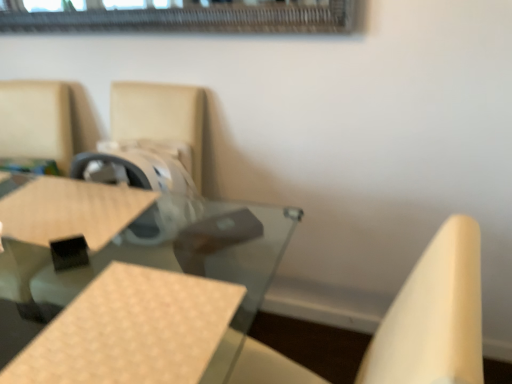
Locate an element on the screen. The width and height of the screenshot is (512, 384). beige woven plywood at center is located at coordinates (131, 330).

Image resolution: width=512 pixels, height=384 pixels. What do you see at coordinates (131, 288) in the screenshot? I see `clear glass table at center` at bounding box center [131, 288].

You are a GUI agent. You are given a task and a screenshot of the screen. Output one action in this format:
    pyautogui.click(x=<x>, y=<y>)
    Task: Click on the clear glass table at center
    Image resolution: width=512 pixels, height=384 pixels.
    Given the screenshot: What is the action you would take?
    pyautogui.click(x=131, y=288)

I want to click on matte brown chair at upper left, so click(45, 121).

Is clear glass table at center positioned in front of beige woven plywood at center?

No, clear glass table at center is further to the viewer.

Find the location of a particular element. table located behind the beige woven plywood at center is located at coordinates (131, 288).

Between clear glass table at center and beige woven plywood at center, which one has smaller width?

beige woven plywood at center.

Is clear glass table at center bigger than beige woven plywood at center?

Indeed, clear glass table at center has a larger size compared to beige woven plywood at center.

From the image's perspective, is matte brown chair at upper left positioned above or below clear glass table at center?

matte brown chair at upper left is situated higher than clear glass table at center in the image.

From a real-world perspective, is matte brown chair at upper left under clear glass table at center?

Actually, matte brown chair at upper left is physically above clear glass table at center in the real world.

Considering the sizes of objects matte brown chair at upper left and clear glass table at center in the image provided, who is taller, matte brown chair at upper left or clear glass table at center?

clear glass table at center is taller.

Consider the image. Which object is positioned more to the right, matte brown chair at upper left or clear glass table at center?

clear glass table at center.

From the image's perspective, is matte brown chair at upper left above or below beige woven plywood at center?

From the image's perspective, matte brown chair at upper left appears above beige woven plywood at center.

Consider the image. Is matte brown chair at upper left oriented towards beige woven plywood at center?

No, matte brown chair at upper left does not turn towards beige woven plywood at center.

Which point is more forward, (6, 106) or (59, 367)?

The point (59, 367) is closer.

Could you tell me if clear glass table at center is facing matte brown chair at upper left?

No, clear glass table at center is not aimed at matte brown chair at upper left.

Considering the relative sizes of clear glass table at center and matte brown chair at upper left in the image provided, is clear glass table at center wider than matte brown chair at upper left?

Indeed, clear glass table at center has a greater width compared to matte brown chair at upper left.

Where is `table on the right side of matte brown chair at upper left`? The image size is (512, 384). table on the right side of matte brown chair at upper left is located at coordinates (131, 288).

Can you tell me how much clear glass table at center and matte brown chair at upper left differ in facing direction?

There is a 0.249-degree angle between the facing directions of clear glass table at center and matte brown chair at upper left.

Considering their positions, is beige woven plywood at center located in front of or behind matte brown chair at upper left?

In the image, beige woven plywood at center appears in front of matte brown chair at upper left.

Which is in front, point (67, 372) or point (53, 151)?

The point (67, 372) is more forward.

Does beige woven plywood at center have a lesser width compared to matte brown chair at upper left?

Yes, beige woven plywood at center is thinner than matte brown chair at upper left.

Is beige woven plywood at center bigger than clear glass table at center?

Actually, beige woven plywood at center might be smaller than clear glass table at center.

Is beige woven plywood at center looking in the opposite direction of clear glass table at center?

Yes.

In the scene shown: Is beige woven plywood at center not within clear glass table at center?

Actually, beige woven plywood at center is at least partially inside clear glass table at center.

This screenshot has width=512, height=384. Find the location of `plywood in front of the clear glass table at center`. plywood in front of the clear glass table at center is located at coordinates (131, 330).

Locate an element on the screen. table on the right of matte brown chair at upper left is located at coordinates (131, 288).

From the image, which object appears to be nearer to clear glass table at center, matte brown chair at upper left or beige woven plywood at center?

matte brown chair at upper left is positioned closer to the anchor clear glass table at center.

Based on their spatial positions, is beige woven plywood at center or clear glass table at center further from matte brown chair at upper left?

Based on the image, beige woven plywood at center appears to be further to matte brown chair at upper left.

From the picture: From the image, which object appears to be nearer to beige woven plywood at center, clear glass table at center or matte brown chair at upper left?

The object closer to beige woven plywood at center is clear glass table at center.

Which object lies nearer to the anchor point matte brown chair at upper left, clear glass table at center or beige woven plywood at center?

clear glass table at center is positioned closer to the anchor matte brown chair at upper left.

Looking at the image, which one is located further to beige woven plywood at center, matte brown chair at upper left or clear glass table at center?

matte brown chair at upper left is positioned further to the anchor beige woven plywood at center.

Considering their positions, is beige woven plywood at center positioned closer to clear glass table at center than matte brown chair at upper left?

matte brown chair at upper left is positioned closer to the anchor clear glass table at center.

At what (x,y) coordinates should I click in order to perform the action: click on table located between beige woven plywood at center and matte brown chair at upper left in the depth direction. Please return your answer as a coordinate pair (x, y). Looking at the image, I should click on (131, 288).